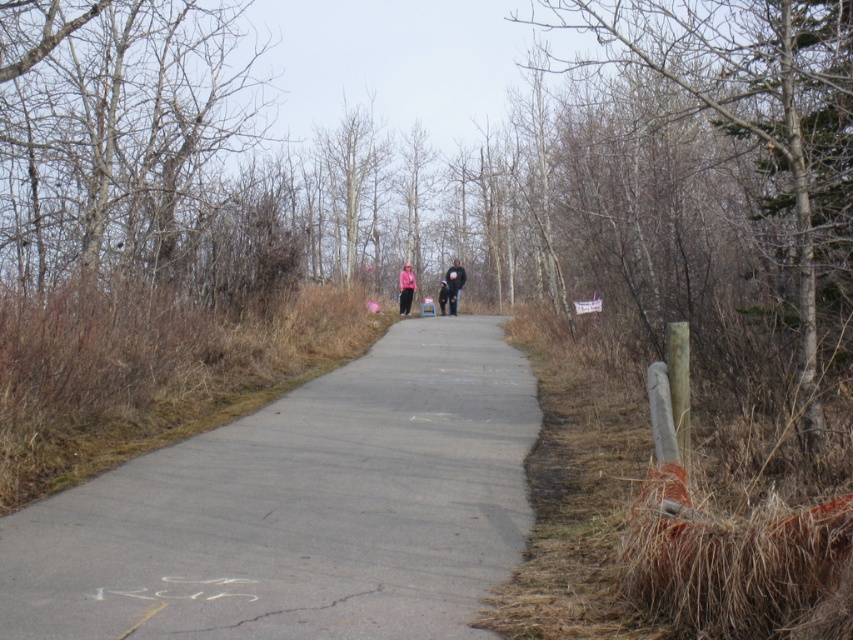
Is the position of gray concrete pavement at center more distant than that of pink fabric at center?

No.

Is gray concrete pavement at center shorter than pink fabric at center?

Yes, gray concrete pavement at center is shorter than pink fabric at center.

Find the location of `gray concrete pavement at center`. gray concrete pavement at center is located at coordinates pos(300,508).

Can you confirm if smooth bark tree at right is positioned to the left of pink fabric at center?

Incorrect, smooth bark tree at right is not on the left side of pink fabric at center.

The image size is (853, 640). What do you see at coordinates (753, 100) in the screenshot?
I see `smooth bark tree at right` at bounding box center [753, 100].

Identify the location of smooth bark tree at right. (753, 100).

Find the location of `smooth bark tree at right`. smooth bark tree at right is located at coordinates (753, 100).

Between point (699, 58) and point (457, 275), which one is positioned in front?

Point (699, 58) is more forward.

The image size is (853, 640). I want to click on smooth bark tree at right, so click(x=753, y=100).